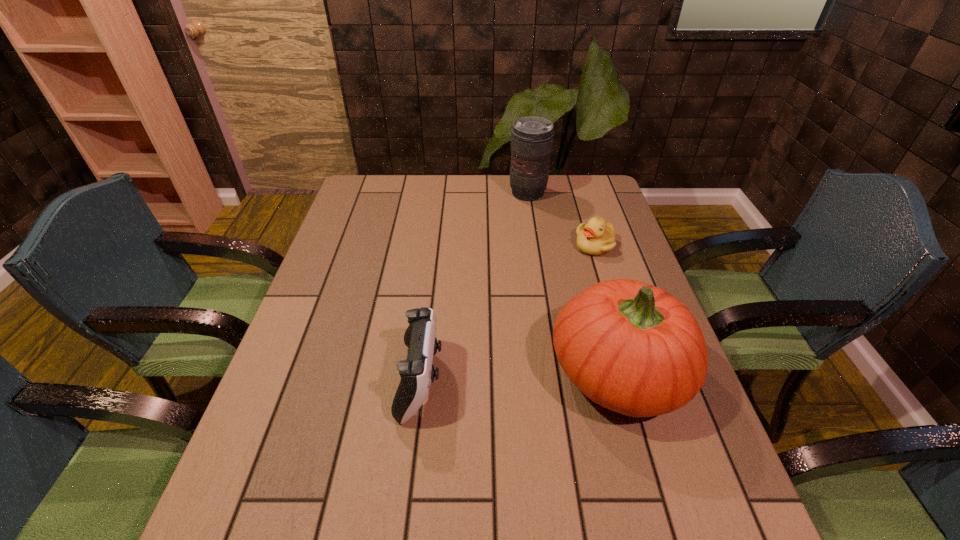
I want to click on the second shortest object, so click(417, 372).

Identify the location of the leftmost object. The image size is (960, 540). (417, 372).

Locate an element on the screen. The width and height of the screenshot is (960, 540). pumpkin is located at coordinates (x=631, y=347).

Image resolution: width=960 pixels, height=540 pixels. I want to click on the third nearest object, so click(x=597, y=237).

Where is `duckling`? The image size is (960, 540). duckling is located at coordinates (597, 237).

The width and height of the screenshot is (960, 540). Identify the location of telephoto lens. (532, 137).

Locate an element on the screen. The width and height of the screenshot is (960, 540). vacant space located 0.080m on the front-facing side of the leftmost object is located at coordinates 478,380.

I want to click on free space located on the back of the pumpkin, so click(x=588, y=267).

Find the location of a particular element. vacant space situated on the beak of the duckling is located at coordinates (586, 271).

The width and height of the screenshot is (960, 540). I want to click on vacant space located 0.260m on the beak of the duckling, so click(x=565, y=318).